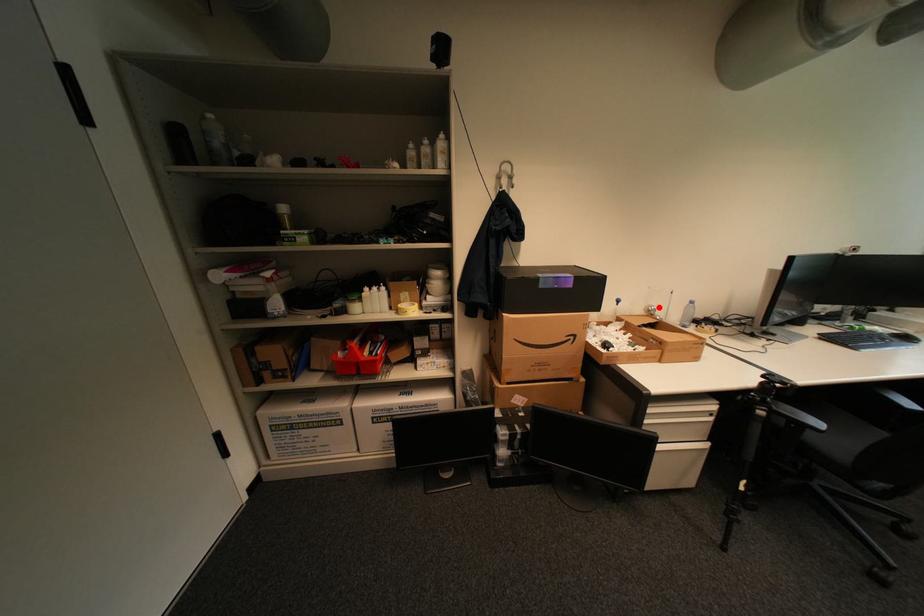
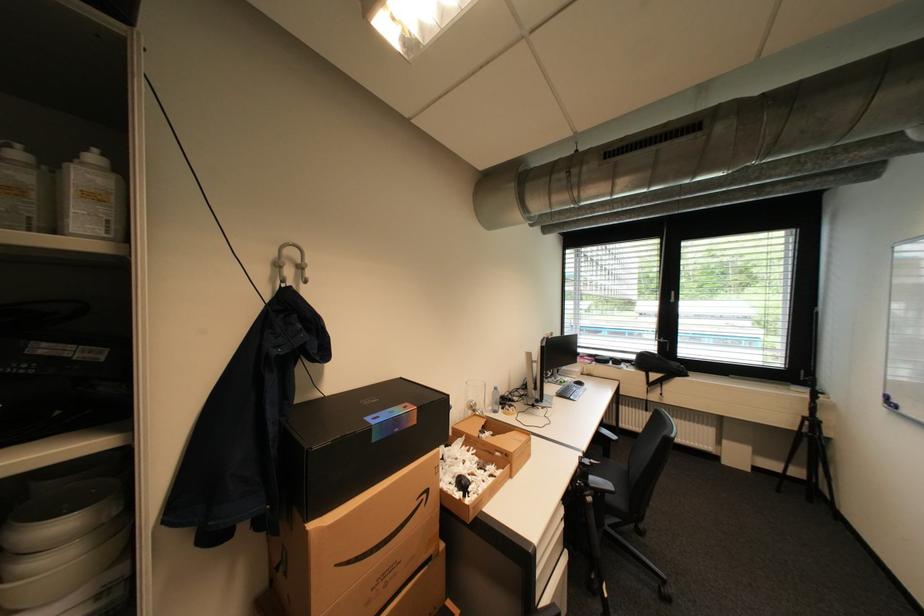
In the second image, find the point that corresponds to the highlighted location in the first image.

(480, 402)